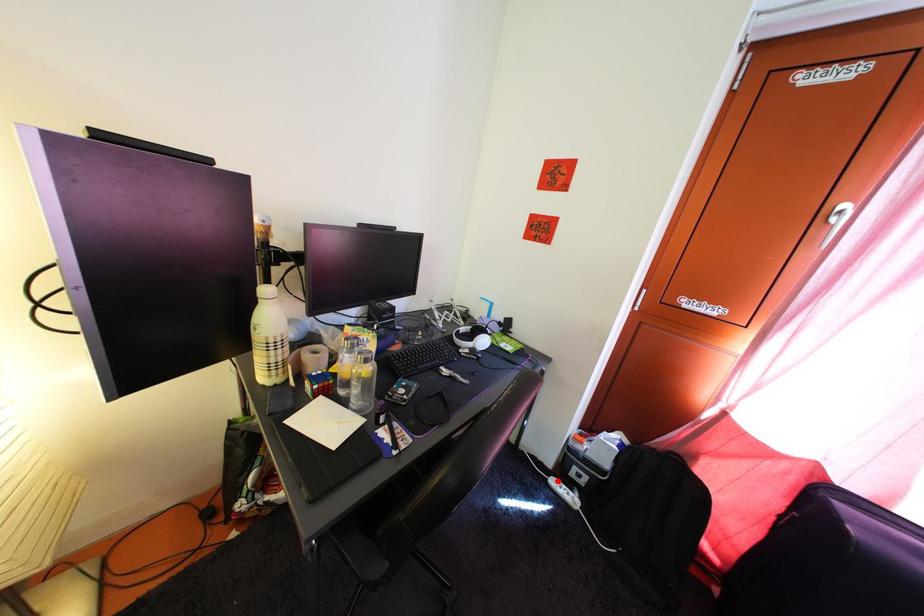
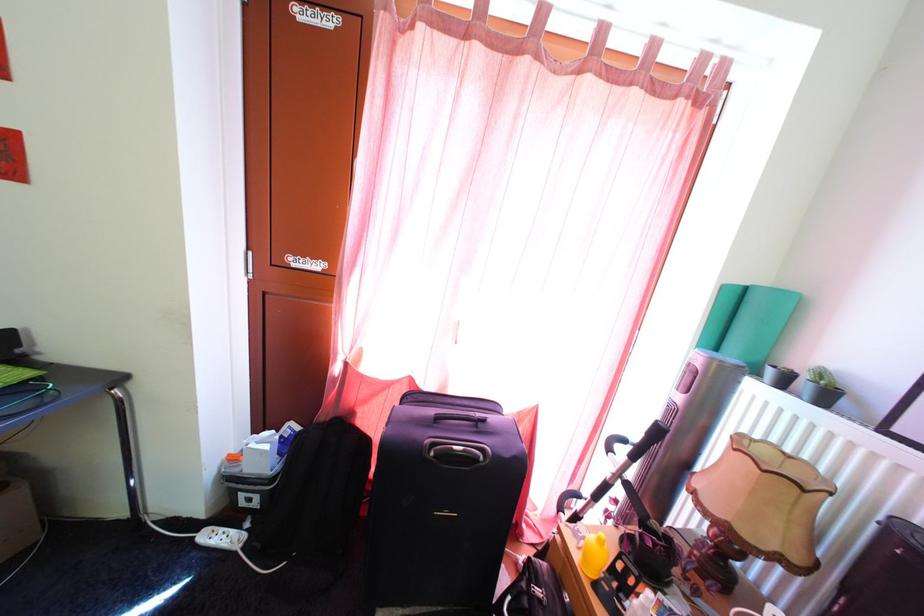
Question: A red point is marked in image1. In image2, is the corresponding 3D point closer to the camera or farther? Reply with the corresponding letter.

Choices:
 (A) The corresponding 3D point is closer.
 (B) The corresponding 3D point is farther.

Answer: (A)